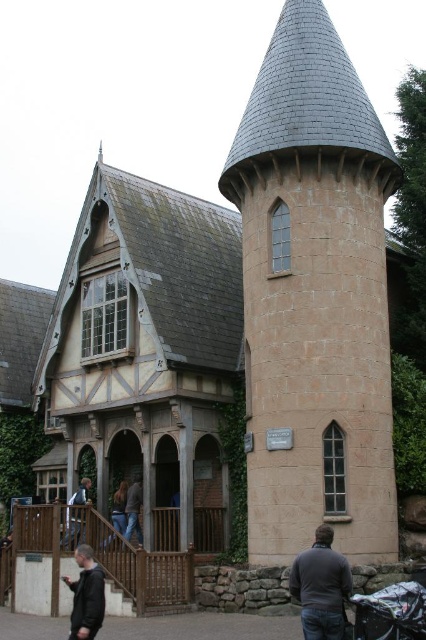
You are a delivery person carrying a package that requires a 40 feet clearance to pass through a narrow alley between the dark gray sweater at lower center and the dark gray jacket at lower left. Can you safely navigate the alley with your package?

The distance between the dark gray sweater at lower center and the dark gray jacket at lower left is 38.79 feet, which is slightly less than the required 40 feet clearance. Therefore, navigating the alley with the package may not be safe due to insufficient space.

Looking at this image, you are standing in front of the medieval building and see the dark gray sweater at lower center and the light brown wooden chair at lower center. Which object is positioned more to the right side?

The dark gray sweater at lower center is positioned to the right of the light brown wooden chair at lower center, so it is more to the right side.

Based on the photo, you are a parent carrying a toddler and need to find a place to sit near the medieval building. You see a black fabric baby carriage at lower right and a light brown wooden chair at lower center. Which object would allow you to sit comfortably with your child?

The light brown wooden chair at lower center would allow you to sit comfortably with your child since it occupies more space than the black fabric baby carriage at lower right, providing a larger seating area.